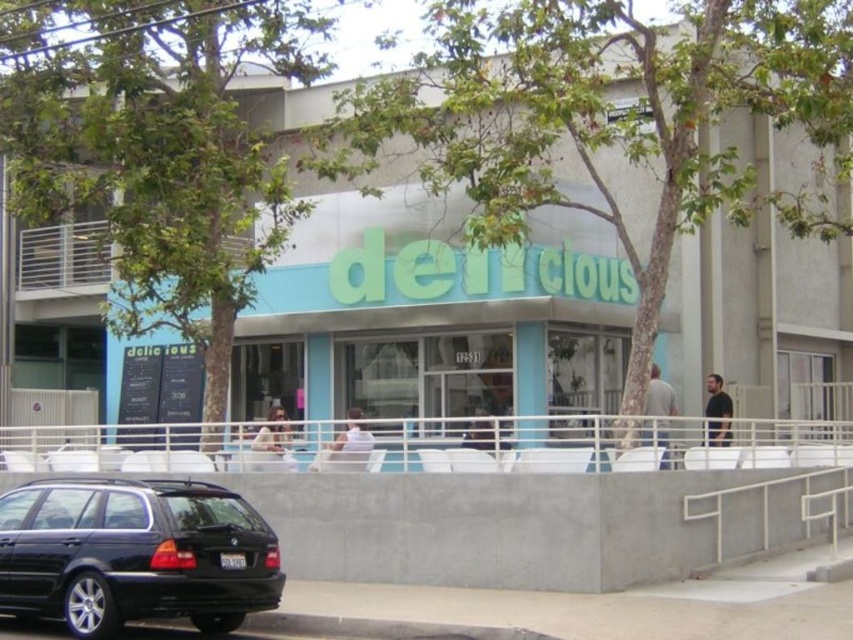
Question: Does black matte wagon at lower left appear on the right side of white fabric chair at center?

Choices:
 (A) yes
 (B) no

Answer: (B)

Question: Does black matte wagon at lower left appear on the right side of white fabric chair at center?

Choices:
 (A) no
 (B) yes

Answer: (A)

Question: Which object is farther from the camera taking this photo?

Choices:
 (A) light brown wooden chair at center
 (B) dark gray shirt at right

Answer: (B)

Question: From the image, what is the correct spatial relationship of blue glass storefront at center in relation to light brown wooden chair at center?

Choices:
 (A) left
 (B) right

Answer: (B)

Question: Which of these objects is positioned farthest from the blue glass storefront at center?

Choices:
 (A) light brown leather jacket at center
 (B) light brown wooden chair at center
 (C) white fabric chair at center

Answer: (B)

Question: Which object appears farthest from the camera in this image?

Choices:
 (A) blue glass storefront at center
 (B) light brown leather jacket at center
 (C) gray fabric shirt at center
 (D) dark gray shirt at right

Answer: (D)